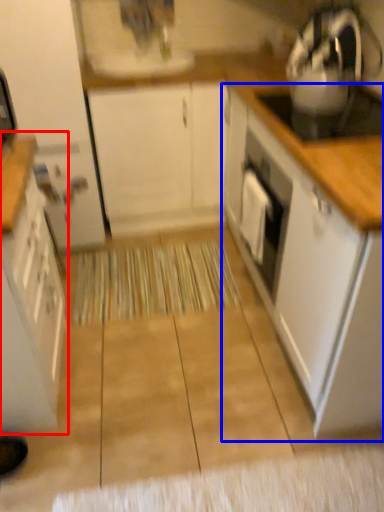
Question: Which of the following is the closest to the observer, cabinetry (highlighted by a red box) or cabinetry (highlighted by a blue box)?

Choices:
 (A) cabinetry
 (B) cabinetry

Answer: (A)